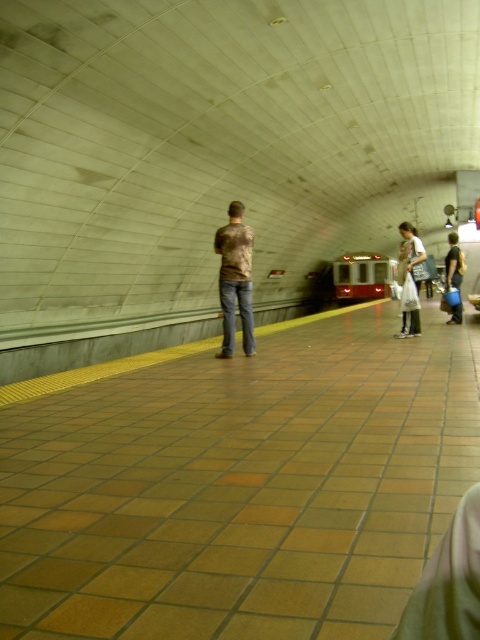
Question: Which object appears farthest from the camera in this image?

Choices:
 (A) brown textured shirt at center
 (B) white cotton shirt at center
 (C) red metallic subway train at center
 (D) denim pants at right

Answer: (C)

Question: Based on their relative distances, which object is farther from the denim pants at right?

Choices:
 (A) brown textured shirt at center
 (B) red metallic subway train at center
 (C) white cotton shirt at center

Answer: (B)

Question: Is white cotton shirt at center bigger than denim pants at right?

Choices:
 (A) no
 (B) yes

Answer: (A)

Question: Is red metallic subway train at center below white cotton shirt at center?

Choices:
 (A) no
 (B) yes

Answer: (A)

Question: Can you confirm if brown textured shirt at center is positioned to the left of white cotton shirt at center?

Choices:
 (A) yes
 (B) no

Answer: (A)

Question: Among these objects, which one is farthest from the camera?

Choices:
 (A) red metallic subway train at center
 (B) brown textured shirt at center

Answer: (A)